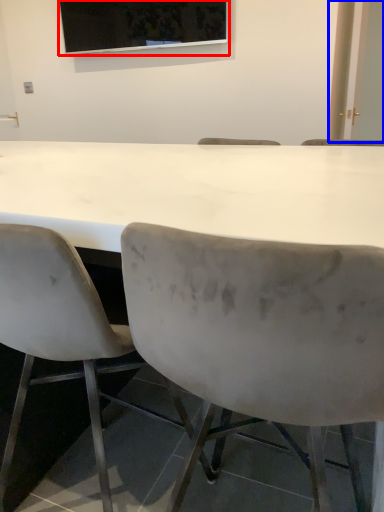
Question: Which point is further to the camera, projection screen (highlighted by a red box) or glass door (highlighted by a blue box)?

Choices:
 (A) projection screen
 (B) glass door

Answer: (B)